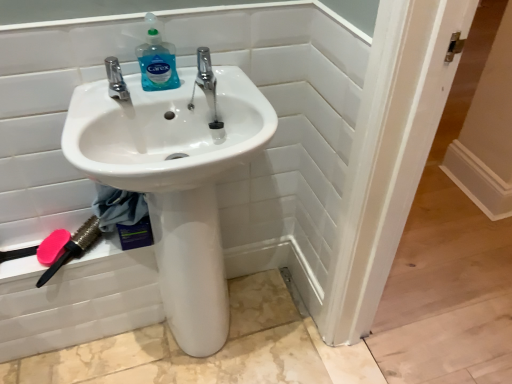
In order to click on free space to the left of polished chrome tap at upper left, which is the 2th tap from right to left in this screenshot , I will do `click(86, 93)`.